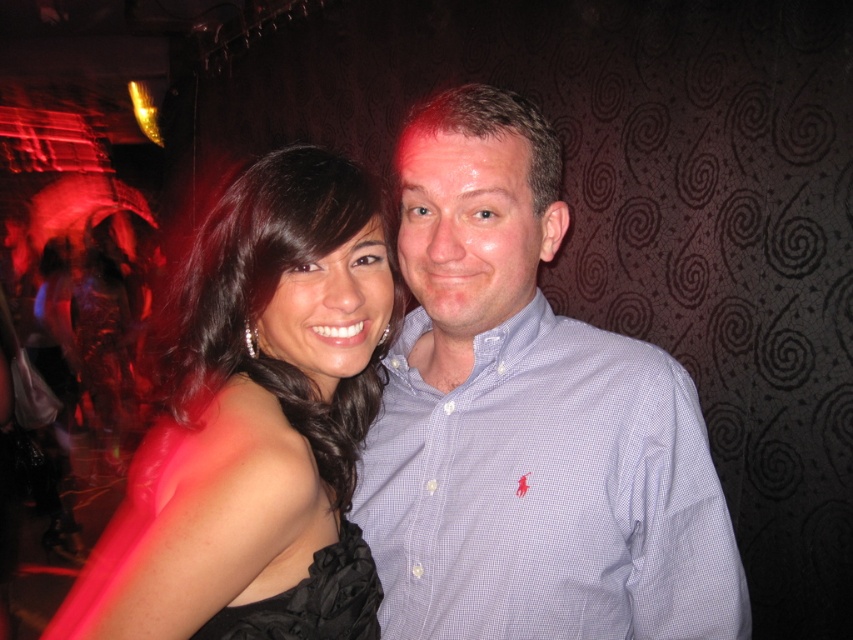
You are a photographer at a party. You want to take a photo of the blue checkered shirt at center and the black satin dress at center. Which one is covering part of the other?

The blue checkered shirt at center is positioned over the black satin dress at center, so the blue checkered shirt at center is covering part of the black satin dress at center.

Based on the photo, you are planning to take a photo of the two individuals wearing the blue checkered shirt at center and the black satin dress at center. If you want to ensure both outfits are fully visible in the frame, which outfit should you adjust to avoid being cut off?

The blue checkered shirt at center might be wider than black satin dress at center, so you should adjust the blue checkered shirt at center to avoid being cut off.

You are at a party and want to take a photo with both the blue checkered shirt at center and the black satin dress at center in the frame. Which one is positioned higher in the image?

The blue checkered shirt at center is taller than the black satin dress at center, so it is positioned higher in the image.